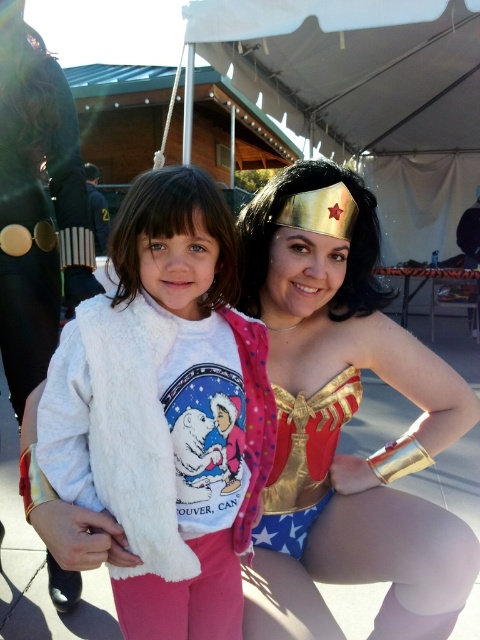
You are trying to decide which costume to wear for a party. You see the gold metallic costume at center and the white fluffy vest at center in the image. Based on their sizes, which one would be more suitable for a child?

The white fluffy vest at center is smaller than the gold metallic costume at center, so it would be more suitable for a child.

Looking at this image, you are a photographer setting up for a photo shoot. You need to position a spotlight above the taller object between the gold metallic costume at center and the white fluffy vest at center. Which object should the spotlight be placed above?

The gold metallic costume at center is taller than the white fluffy vest at center, so the spotlight should be placed above the gold metallic costume at center.

You are a photographer trying to adjust the lighting for a photo of the gold metallic costume at center and the white fluffy vest at center. Since the lighting is better above, which object should you position closer to the light source?

The white fluffy vest at center should be positioned closer to the light source because it is located above the gold metallic costume at center, so it can better utilize the improved lighting above.